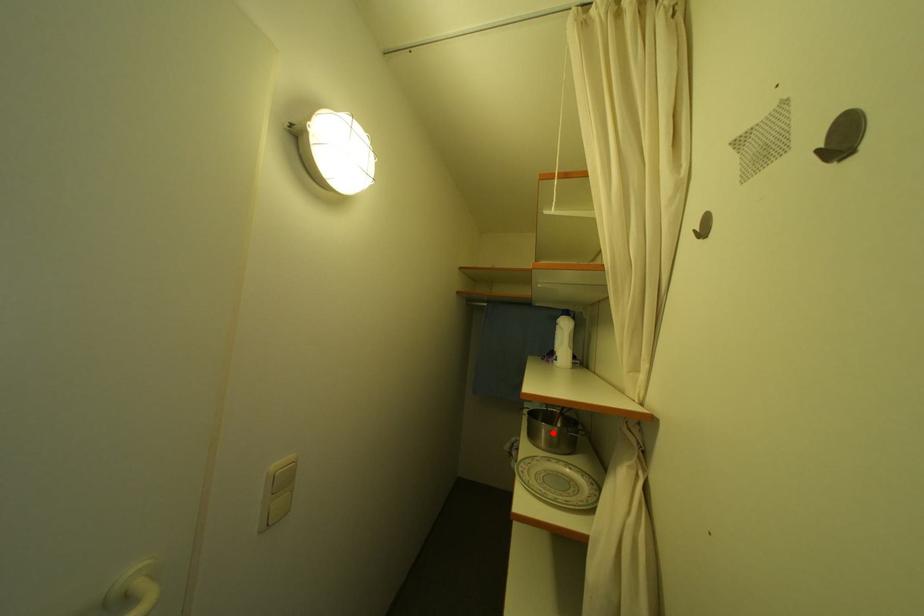
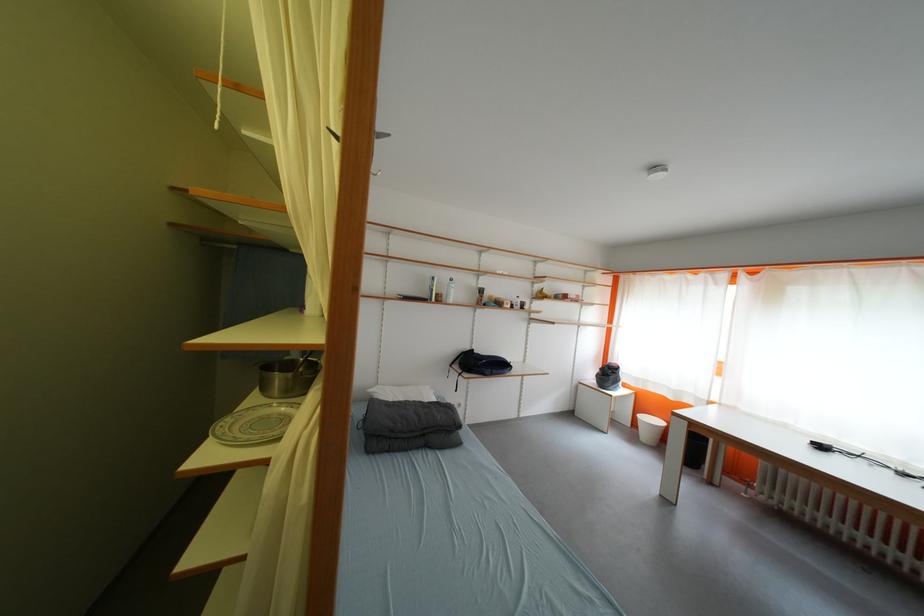
Question: I am providing you with two images of the same scene from different viewpoints. In image1, a red point is highlighted. Considering the same 3D point in image2, which of the following is correct?

Choices:
 (A) It is closer
 (B) It is farther

Answer: (A)